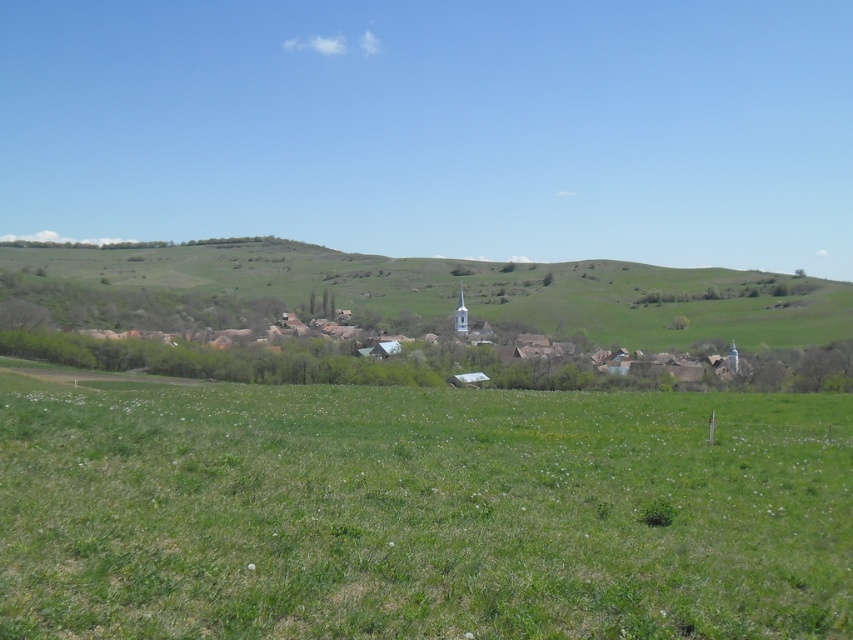
Can you confirm if green grass pasture at center is positioned above green grassy hillside at center?

Actually, green grass pasture at center is below green grassy hillside at center.

Who is positioned more to the right, green grass pasture at center or green grassy hillside at center?

green grass pasture at center is more to the right.

Identify the location of green grass pasture at center. The image size is (853, 640). click(421, 513).

Where is `green grass pasture at center`? green grass pasture at center is located at coordinates (x=421, y=513).

Is green grassy hillside at center to the right of white wooden houses at center from the viewer's perspective?

No, green grassy hillside at center is not to the right of white wooden houses at center.

Image resolution: width=853 pixels, height=640 pixels. What do you see at coordinates (445, 291) in the screenshot? I see `green grassy hillside at center` at bounding box center [445, 291].

What do you see at coordinates (445, 291) in the screenshot?
I see `green grassy hillside at center` at bounding box center [445, 291].

The image size is (853, 640). In order to click on green grassy hillside at center in this screenshot , I will do `click(445, 291)`.

Which of these two, green grass pasture at center or white wooden houses at center, stands shorter?

green grass pasture at center

Who is lower down, green grass pasture at center or white wooden houses at center?

green grass pasture at center

Who is more forward, (67, 420) or (587, 380)?

Point (67, 420)

Locate an element on the screen. This screenshot has height=640, width=853. green grass pasture at center is located at coordinates (421, 513).